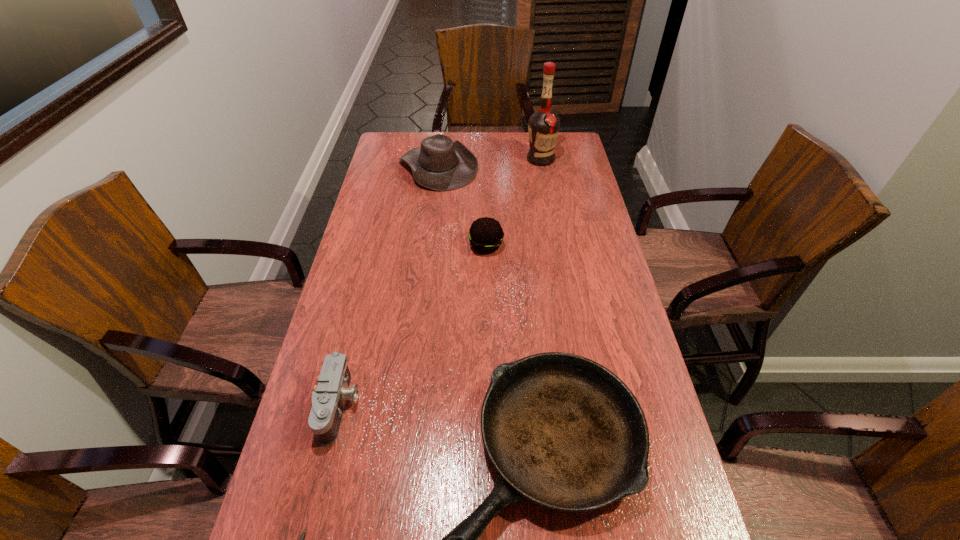
Where is `cowboy hat that is at the left edge`? cowboy hat that is at the left edge is located at coordinates (441, 164).

This screenshot has width=960, height=540. I want to click on camera positioned at the left edge, so click(329, 397).

Where is `object present at the right edge`? The width and height of the screenshot is (960, 540). object present at the right edge is located at coordinates (543, 126).

Identify the location of object that is positioned at the far left corner. (441, 164).

The width and height of the screenshot is (960, 540). In order to click on object located at the far right corner in this screenshot , I will do `click(543, 126)`.

Find the location of `free space at the far edge`. free space at the far edge is located at coordinates (528, 144).

In the image, there is a desktop. Where is `free space at the left edge`? This screenshot has width=960, height=540. free space at the left edge is located at coordinates (276, 506).

In order to click on free space at the right edge in this screenshot , I will do `click(617, 313)`.

Find the location of a particular element. vacant space at the far left corner of the desktop is located at coordinates (396, 136).

In the image, there is a desktop. Where is `free space at the far right corner`? The width and height of the screenshot is (960, 540). free space at the far right corner is located at coordinates (573, 141).